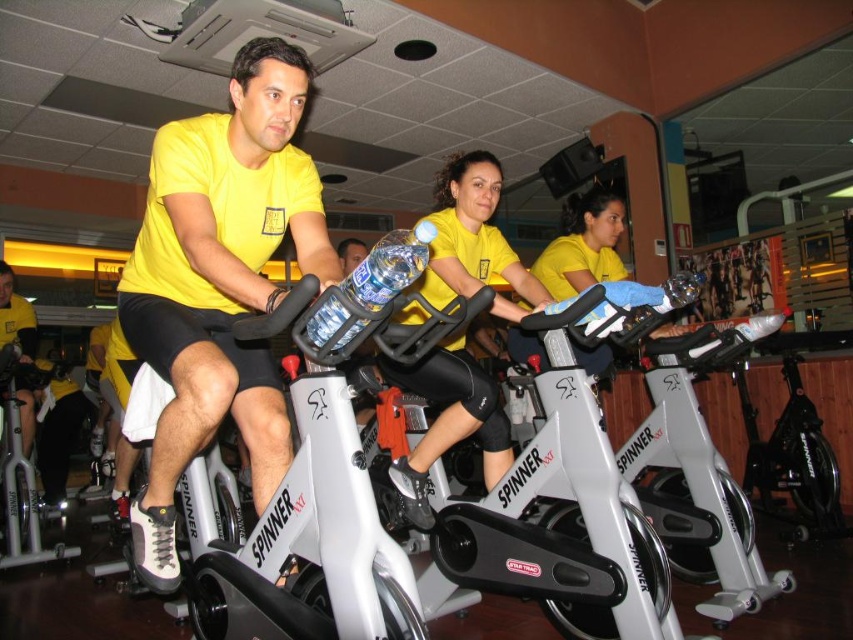
Which of these two, matte yellow shirt at center or yellow matte jersey at center, stands shorter?

yellow matte jersey at center

Can you confirm if matte yellow shirt at center is positioned below yellow matte jersey at center?

Yes, matte yellow shirt at center is below yellow matte jersey at center.

Who is more forward, (277, 472) or (430, 426)?

Point (277, 472) is in front.

At what (x,y) coordinates should I click in order to perform the action: click on matte yellow shirt at center. Please return your answer as a coordinate pair (x, y). Looking at the image, I should click on (219, 282).